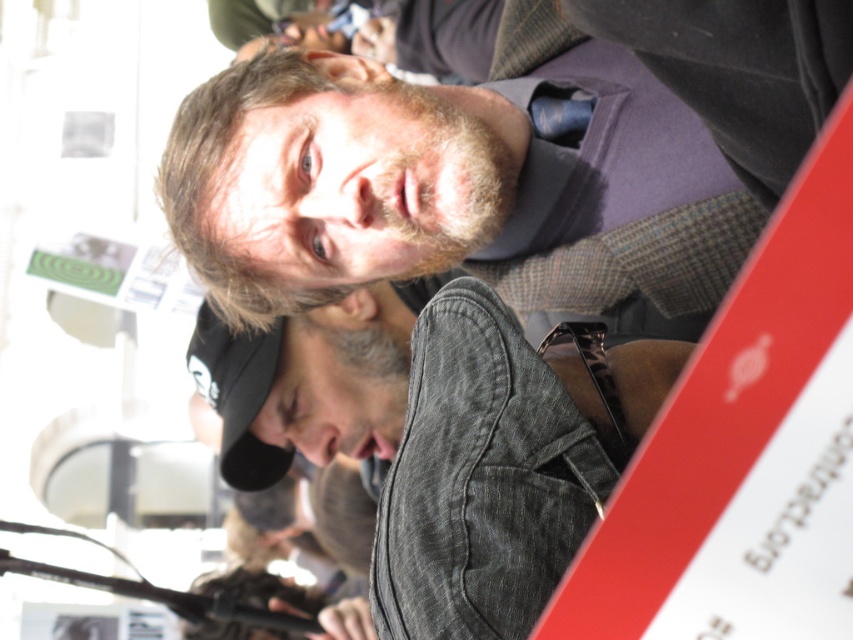
Who is lower down, matte gray jacket at center or dark gray denim jacket at lower center?

dark gray denim jacket at lower center

Can you confirm if matte gray jacket at center is smaller than dark gray denim jacket at lower center?

Actually, matte gray jacket at center might be larger than dark gray denim jacket at lower center.

Which is behind, point (310, 211) or point (544, 568)?

Positioned behind is point (310, 211).

Image resolution: width=853 pixels, height=640 pixels. I want to click on matte gray jacket at center, so click(450, 186).